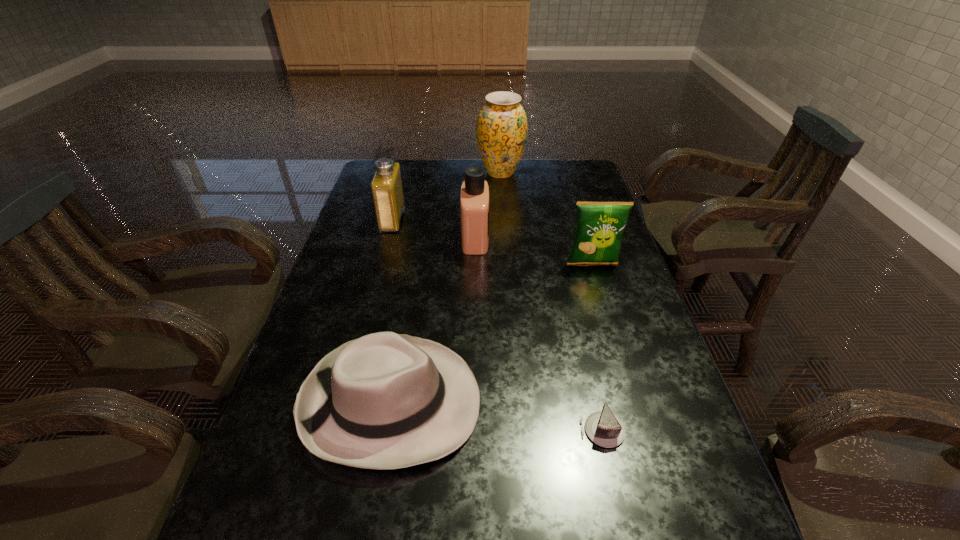
Where is `vacant space in between the third nearest object and the tallest object`? vacant space in between the third nearest object and the tallest object is located at coordinates (546, 218).

This screenshot has width=960, height=540. What are the coordinates of `free space between the vase and the crisp (potato chip)` in the screenshot? It's located at (546, 218).

You are a GUI agent. You are given a task and a screenshot of the screen. Output one action in this format:
    pyautogui.click(x=<x>, y=<y>)
    Task: Click on the object that can be found as the closest to the vase
    The image size is (960, 540).
    Given the screenshot: What is the action you would take?
    pyautogui.click(x=474, y=197)

Identify the location of object that stands as the fourth closest to the left perfume. The image size is (960, 540). (599, 228).

The image size is (960, 540). Find the location of `vacant space that satisfies the following two spatial constraints: 1. on the front-facing side of the third nearest object; 2. on the front-facing side of the fedora`. vacant space that satisfies the following two spatial constraints: 1. on the front-facing side of the third nearest object; 2. on the front-facing side of the fedora is located at coordinates (635, 402).

Where is `free space that satisfies the following two spatial constraints: 1. on the front-facing side of the left perfume; 2. on the left side of the shortest object`? free space that satisfies the following two spatial constraints: 1. on the front-facing side of the left perfume; 2. on the left side of the shortest object is located at coordinates (336, 430).